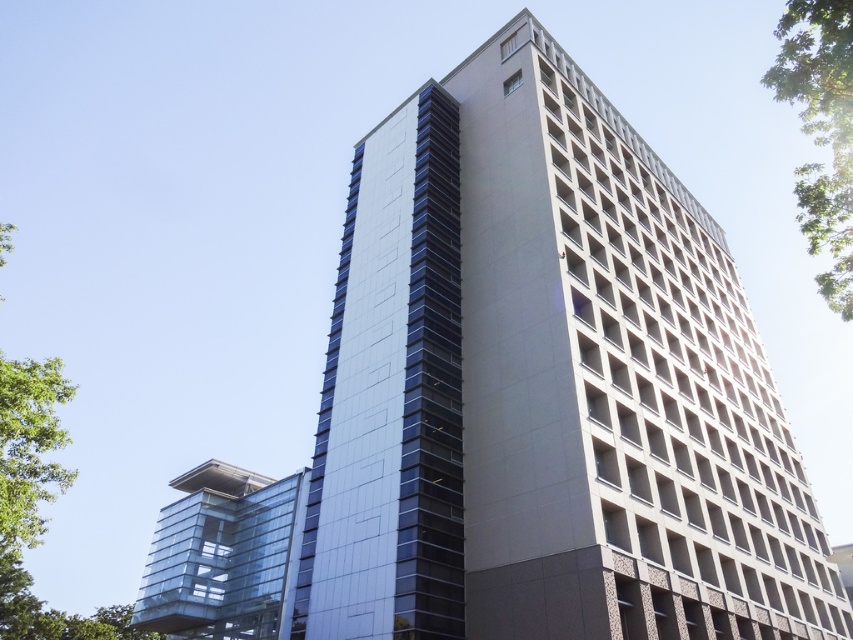
In the scene shown: You are an architect evaluating the building layout. Which of the two glass structures, the glossy glass tower at center or the transparent glass tower at lower left, would require more structural support due to its height?

The glossy glass tower at center requires more structural support because it is much taller than the transparent glass tower at lower left.